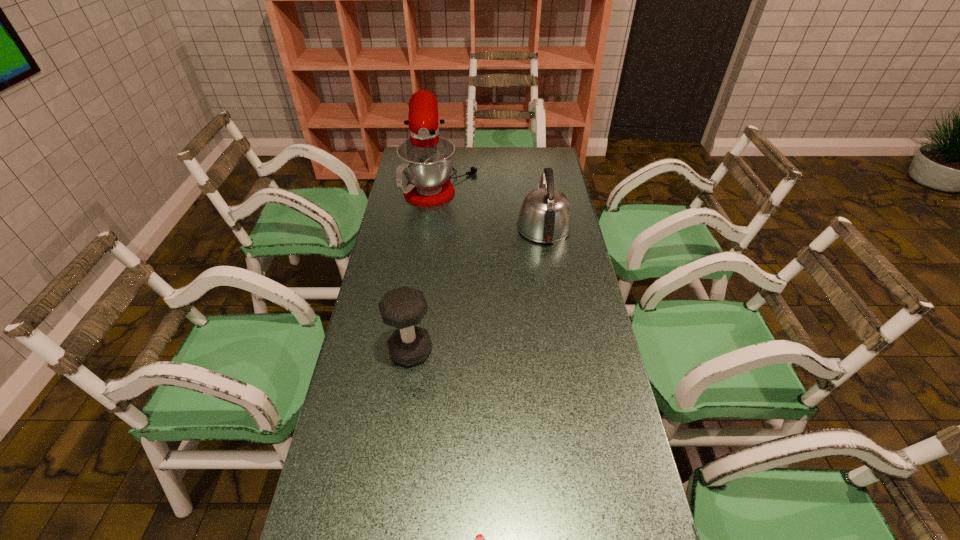
Identify the location of vacant space that's between the rightmost object and the third farthest object. click(x=477, y=289).

Locate an element on the screen. The height and width of the screenshot is (540, 960). free space between the second nearest object and the rightmost object is located at coordinates (477, 289).

Select which object is the second closest to the kettle. Please provide its 2D coordinates. Your answer should be formatted as a tuple, i.e. [(x, y)], where the tuple contains the x and y coordinates of a point satisfying the conditions above.

[(404, 307)]

Identify which object is the third closest to the rightmost object. Please provide its 2D coordinates. Your answer should be formatted as a tuple, i.e. [(x, y)], where the tuple contains the x and y coordinates of a point satisfying the conditions above.

[(479, 539)]

The height and width of the screenshot is (540, 960). I want to click on blank space that satisfies the following two spatial constraints: 1. on the bowl side of the mixer; 2. on the spout of the rightmost object, so click(436, 227).

I want to click on free spot that satisfies the following two spatial constraints: 1. on the bowl side of the mixer; 2. on the spout of the kettle, so click(436, 227).